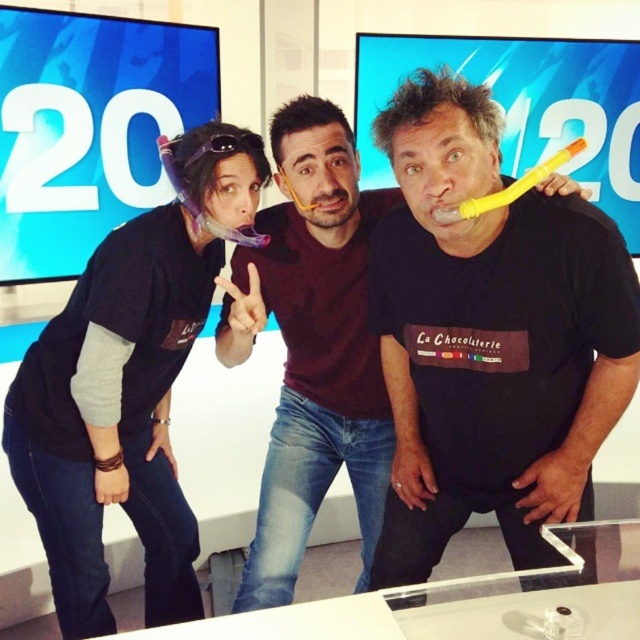
Can you confirm if black matte t-shirt at center is positioned below yellow rubber toothbrush at center?

Correct, black matte t-shirt at center is located below yellow rubber toothbrush at center.

Can you confirm if black matte t-shirt at center is shorter than yellow rubber toothbrush at center?

No.

Find the location of `black matte t-shirt at center`. black matte t-shirt at center is located at coordinates (310, 346).

Which is more to the left, matte black t-shirt at center or black matte t-shirt at center?

matte black t-shirt at center is more to the left.

Can you confirm if matte black t-shirt at center is taller than black matte t-shirt at center?

In fact, matte black t-shirt at center may be shorter than black matte t-shirt at center.

You are a GUI agent. You are given a task and a screenshot of the screen. Output one action in this format:
    pyautogui.click(x=<x>, y=<y>)
    Task: Click on the matte black t-shirt at center
    
    Given the screenshot: What is the action you would take?
    pyautogui.click(x=128, y=387)

This screenshot has height=640, width=640. Describe the element at coordinates (128, 387) in the screenshot. I see `matte black t-shirt at center` at that location.

Is matte black t-shirt at center wider than yellow rubber toothbrush at center?

Correct, the width of matte black t-shirt at center exceeds that of yellow rubber toothbrush at center.

Does point (92, 376) come closer to viewer compared to point (464, 202)?

No, (92, 376) is behind (464, 202).

This screenshot has width=640, height=640. Find the location of `matte black t-shirt at center`. matte black t-shirt at center is located at coordinates (128, 387).